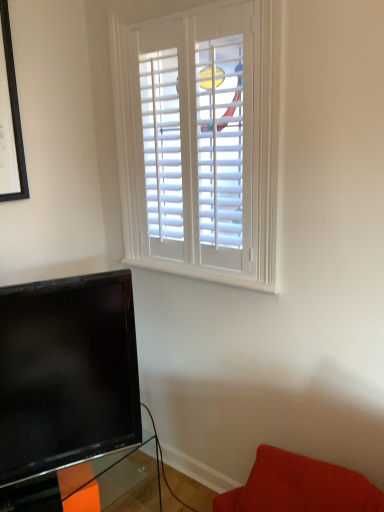
Question: From the image's perspective, is transparent glass table at lower left under velvety red cushion at lower right?

Choices:
 (A) yes
 (B) no

Answer: (A)

Question: From a real-world perspective, is transparent glass table at lower left physically below velvety red cushion at lower right?

Choices:
 (A) yes
 (B) no

Answer: (A)

Question: Are transparent glass table at lower left and velvety red cushion at lower right beside each other?

Choices:
 (A) no
 (B) yes

Answer: (A)

Question: Considering the relative sizes of transparent glass table at lower left and velvety red cushion at lower right in the image provided, is transparent glass table at lower left thinner than velvety red cushion at lower right?

Choices:
 (A) no
 (B) yes

Answer: (A)

Question: Are transparent glass table at lower left and velvety red cushion at lower right located far from each other?

Choices:
 (A) no
 (B) yes

Answer: (A)

Question: Is velvety red cushion at lower right surrounded by transparent glass table at lower left?

Choices:
 (A) yes
 (B) no

Answer: (B)

Question: Is velvety red cushion at lower right positioned behind transparent glass table at lower left?

Choices:
 (A) no
 (B) yes

Answer: (A)

Question: Is velvety red cushion at lower right to the left of transparent glass table at lower left from the viewer's perspective?

Choices:
 (A) no
 (B) yes

Answer: (A)

Question: From a real-world perspective, is velvety red cushion at lower right located beneath transparent glass table at lower left?

Choices:
 (A) yes
 (B) no

Answer: (B)

Question: Does velvety red cushion at lower right have a greater height compared to transparent glass table at lower left?

Choices:
 (A) no
 (B) yes

Answer: (A)

Question: Is velvety red cushion at lower right placed right next to transparent glass table at lower left?

Choices:
 (A) yes
 (B) no

Answer: (B)

Question: Can we say velvety red cushion at lower right lies outside transparent glass table at lower left?

Choices:
 (A) no
 (B) yes

Answer: (B)

Question: Is point (97, 488) positioned closer to the camera than point (253, 480)?

Choices:
 (A) closer
 (B) farther

Answer: (B)